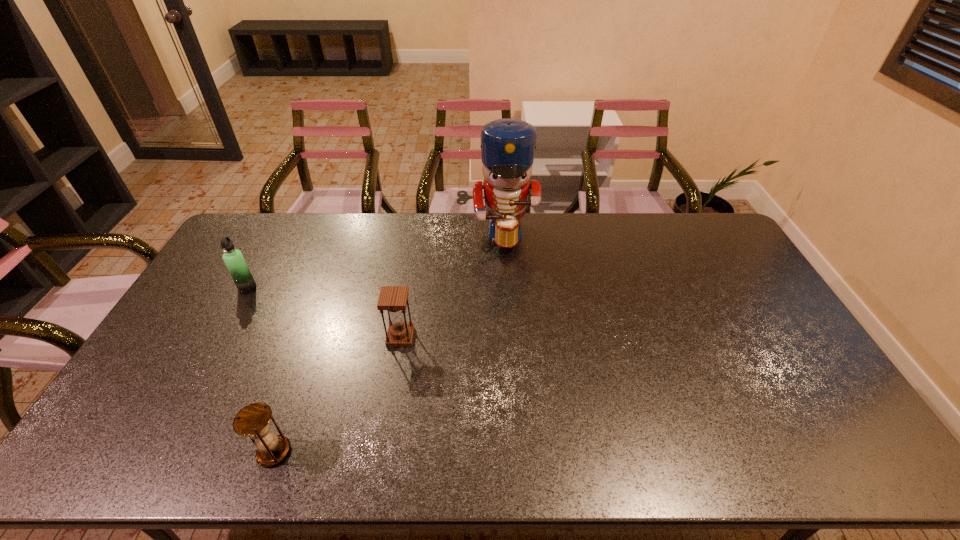
What are the coordinates of `the rightmost object` in the screenshot? It's located at (508, 145).

The height and width of the screenshot is (540, 960). In order to click on the tallest object in this screenshot , I will do `click(508, 145)`.

Identify the location of the third shortest object. (233, 258).

At what (x,y) coordinates should I click in order to perform the action: click on the leftmost object. Please return your answer as a coordinate pair (x, y). Looking at the image, I should click on (233, 258).

Where is `the second nearest object`? The image size is (960, 540). the second nearest object is located at coordinates (394, 299).

Identify the location of the second object from right to left. (394, 299).

The height and width of the screenshot is (540, 960). In order to click on the nearer hourglass in this screenshot , I will do `click(253, 420)`.

You are a GUI agent. You are given a task and a screenshot of the screen. Output one action in this format:
    pyautogui.click(x=<x>, y=<y>)
    Task: Click on the left hourglass
    
    Given the screenshot: What is the action you would take?
    pyautogui.click(x=253, y=420)

At what (x,y) coordinates should I click in order to perform the action: click on vacant space located 0.170m on the front-facing side of the tallest object. Please return your answer as a coordinate pair (x, y). This screenshot has width=960, height=540. Looking at the image, I should click on (500, 289).

The width and height of the screenshot is (960, 540). I want to click on vacant space located 0.290m on the back of the thermos bottle, so click(x=279, y=230).